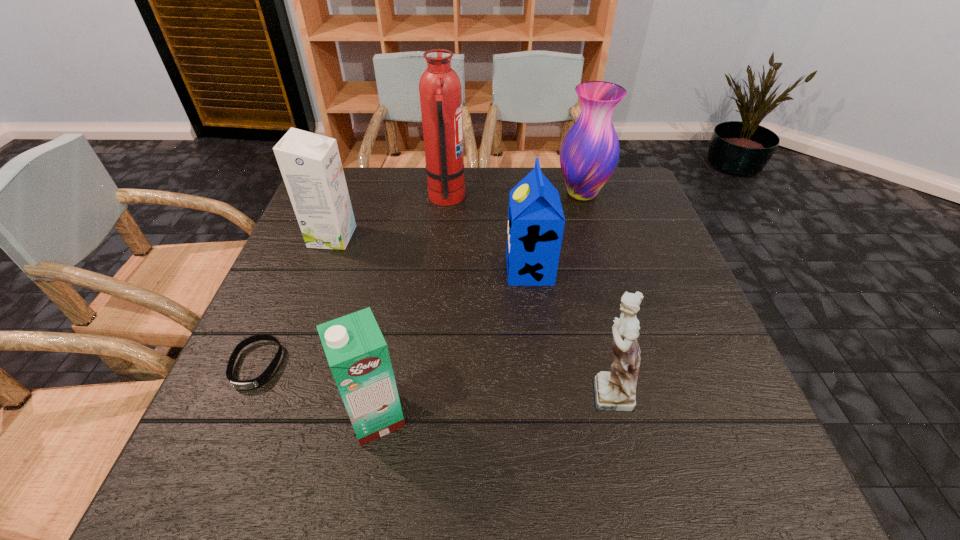
The image size is (960, 540). I want to click on fire extinguisher, so pos(440,89).

The height and width of the screenshot is (540, 960). I want to click on vase, so click(x=589, y=153).

Find the location of `the fifth nearest object`. the fifth nearest object is located at coordinates (310, 164).

This screenshot has width=960, height=540. I want to click on the leftmost carton, so click(x=310, y=164).

What are the coordinates of `the fifth object from left to right` in the screenshot? It's located at (536, 221).

The height and width of the screenshot is (540, 960). What are the coordinates of `the rightmost carton` in the screenshot? It's located at (536, 221).

Locate an element on the screen. figurine is located at coordinates (613, 391).

Find the location of a particular element. the second carton from left to right is located at coordinates (357, 353).

This screenshot has height=540, width=960. Find the location of `the shortest object`. the shortest object is located at coordinates (264, 377).

You are a GUI agent. You are given a task and a screenshot of the screen. Output one action in this format:
    pyautogui.click(x=<x>, y=<y>)
    Task: Click on the vacant area situated on the label side of the tallest object
    Image resolution: width=960 pixels, height=540 pixels.
    Given the screenshot: What is the action you would take?
    pyautogui.click(x=543, y=198)